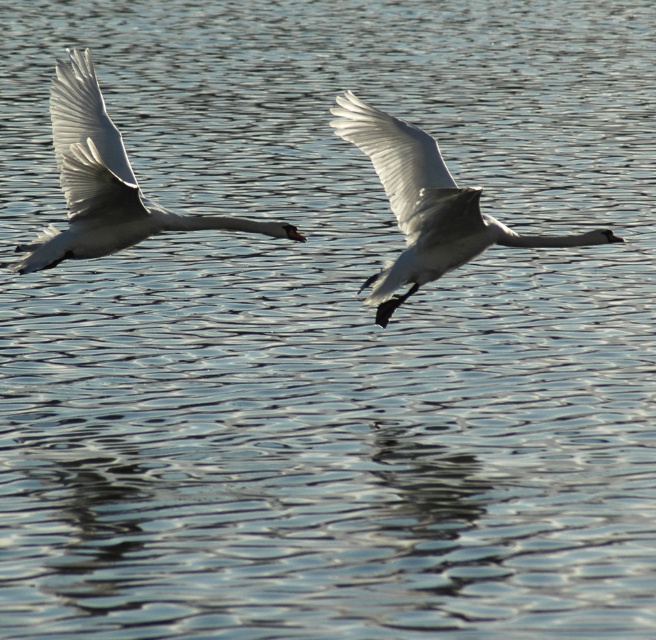
Is white glossy swan at center to the left of white glossy wing at left from the viewer's perspective?

Incorrect, white glossy swan at center is not on the left side of white glossy wing at left.

Who is more forward, (400,156) or (113,164)?

Positioned in front is point (113,164).

Identify the location of white glossy swan at center. This screenshot has height=640, width=656. (426, 204).

Is white glossy swan at left bigger than white glossy wing at center?

Correct, white glossy swan at left is larger in size than white glossy wing at center.

Which is behind, point (253, 224) or point (335, 112)?

The point (335, 112) is more distant.

Which is in front, point (77, 192) or point (348, 93)?

Positioned in front is point (77, 192).

Image resolution: width=656 pixels, height=640 pixels. I want to click on white glossy swan at left, so click(106, 180).

Who is higher up, white glossy wing at center or white glossy wing at left?

white glossy wing at left is higher up.

Between white glossy wing at center and white glossy wing at left, which one appears on the left side from the viewer's perspective?

From the viewer's perspective, white glossy wing at left appears more on the left side.

Locate an element on the screen. Image resolution: width=656 pixels, height=640 pixels. white glossy wing at center is located at coordinates (392, 154).